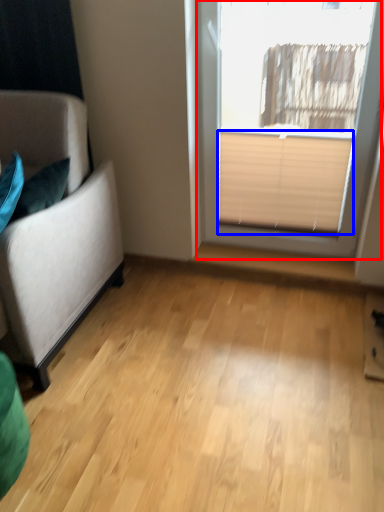
Question: Among these objects, which one is nearest to the camera, window (highlighted by a red box) or blind (highlighted by a blue box)?

Choices:
 (A) window
 (B) blind

Answer: (A)